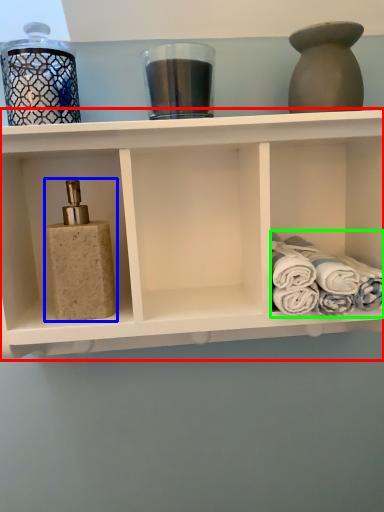
Question: Which object is the farthest from shelf (highlighted by a red box)? Choose among these: toiletry (highlighted by a blue box) or bath towel (highlighted by a green box).

Choices:
 (A) toiletry
 (B) bath towel

Answer: (B)